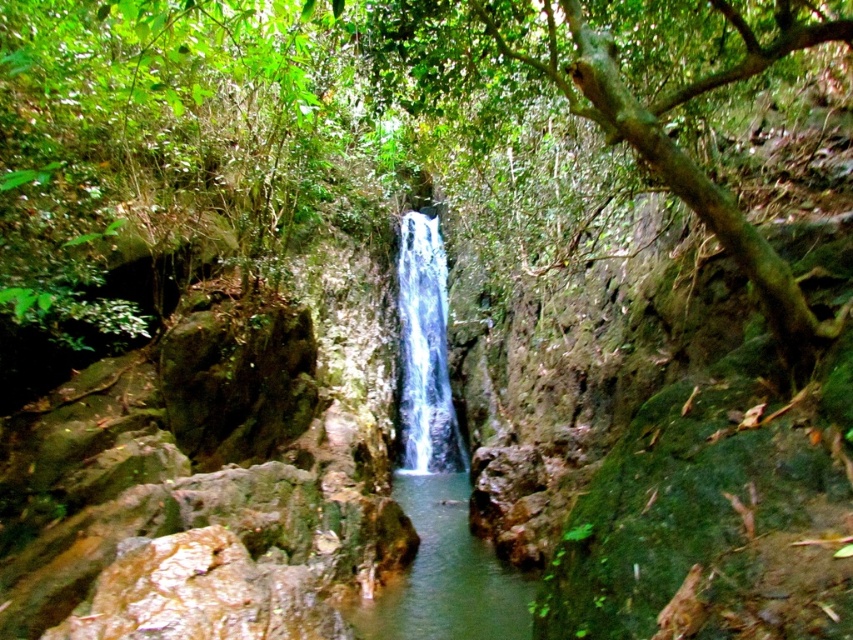
Question: Considering the relative positions of green leafy tree at center and clear water at center in the image provided, where is green leafy tree at center located with respect to clear water at center?

Choices:
 (A) above
 (B) below

Answer: (A)

Question: Which object appears farthest from the camera in this image?

Choices:
 (A) green leafy tree at center
 (B) clear water at center

Answer: (B)

Question: Which point is closer to the camera?

Choices:
 (A) (576, 1)
 (B) (402, 385)

Answer: (A)

Question: Is green leafy tree at center smaller than clear water at center?

Choices:
 (A) yes
 (B) no

Answer: (B)

Question: Among these objects, which one is farthest from the camera?

Choices:
 (A) green leafy tree at center
 (B) clear water at center

Answer: (B)

Question: Can you confirm if green leafy tree at center is bigger than clear water at center?

Choices:
 (A) yes
 (B) no

Answer: (A)